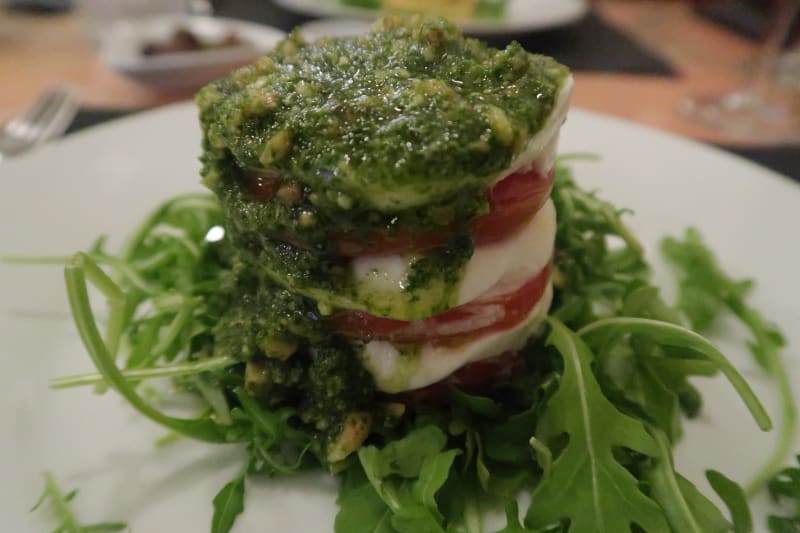
The height and width of the screenshot is (533, 800). I want to click on stem of wine glass, so click(x=772, y=50).